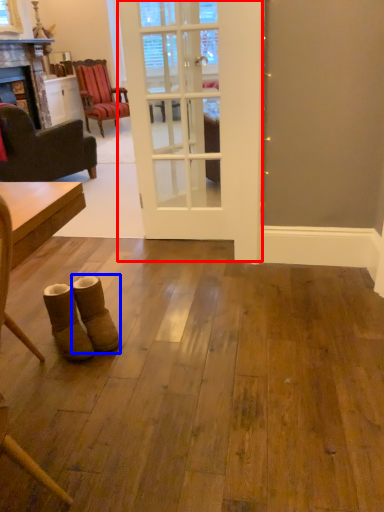
Question: Which point is further to the camera, door (highlighted by a red box) or footwear (highlighted by a blue box)?

Choices:
 (A) door
 (B) footwear

Answer: (A)